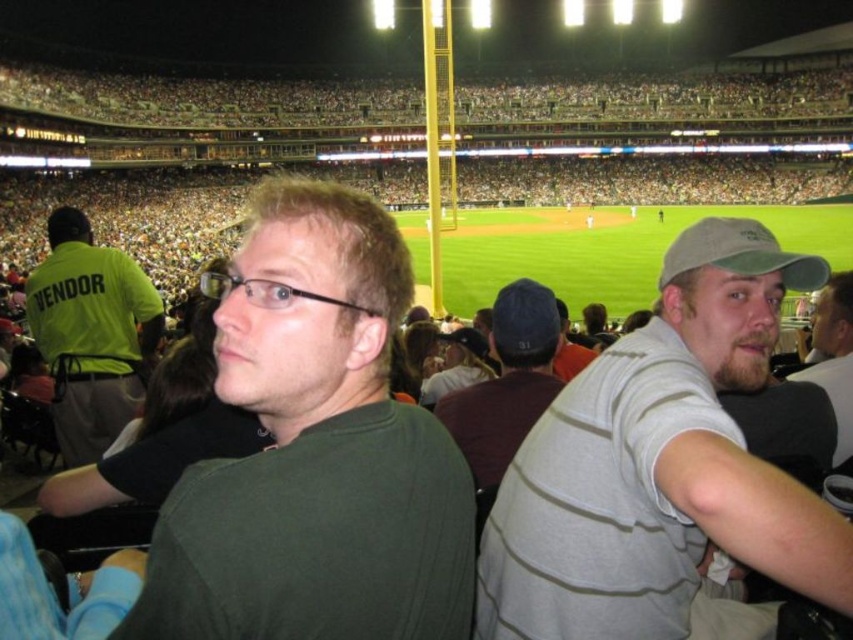
Between gray striped shirt at right and beige fabric cap at right, which one has more height?

Standing taller between the two is gray striped shirt at right.

The height and width of the screenshot is (640, 853). Identify the location of gray striped shirt at right. (660, 465).

Looking at this image, can you confirm if neon green shirt at left is positioned above beige fabric cap at right?

Yes.

Between neon green shirt at left and beige fabric cap at right, which one has more height?

neon green shirt at left

Locate an element on the screen. neon green shirt at left is located at coordinates (91, 332).

Is gray striped shirt at right to the left of neon green shirt at left from the viewer's perspective?

No, gray striped shirt at right is not to the left of neon green shirt at left.

Between gray striped shirt at right and neon green shirt at left, which one is positioned higher?

neon green shirt at left

What are the coordinates of `gray striped shirt at right` in the screenshot? It's located at (660, 465).